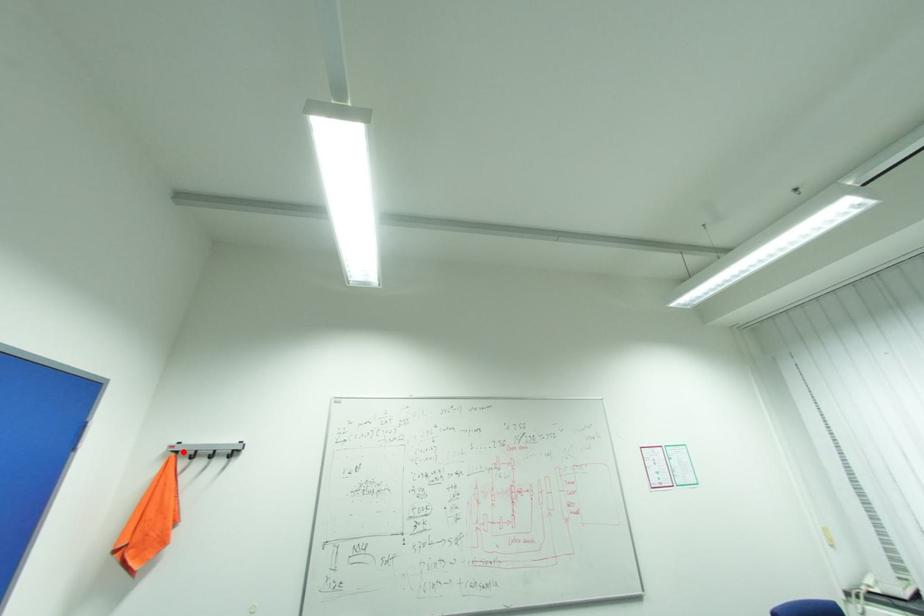
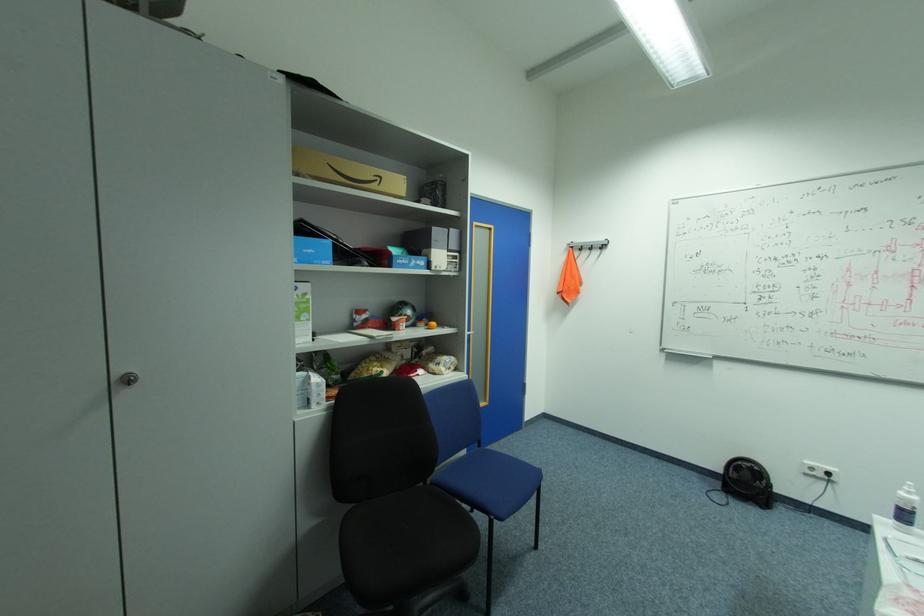
Where in the second image is the point corresponding to the highlighted location from the first image?

(578, 246)